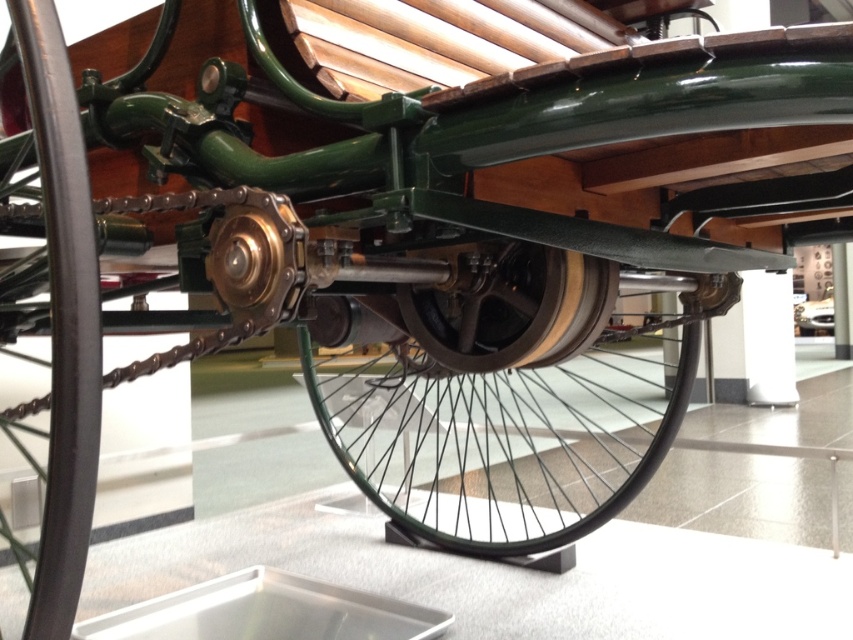
You are a mechanic trying to inspect the undercarriage of a vintage steam car. You notice a point located at coordinates [62,321]. Based on the scene description, can you determine what component this point is on?

The point at coordinates [62,321] is on the black rubber tire at lower left.